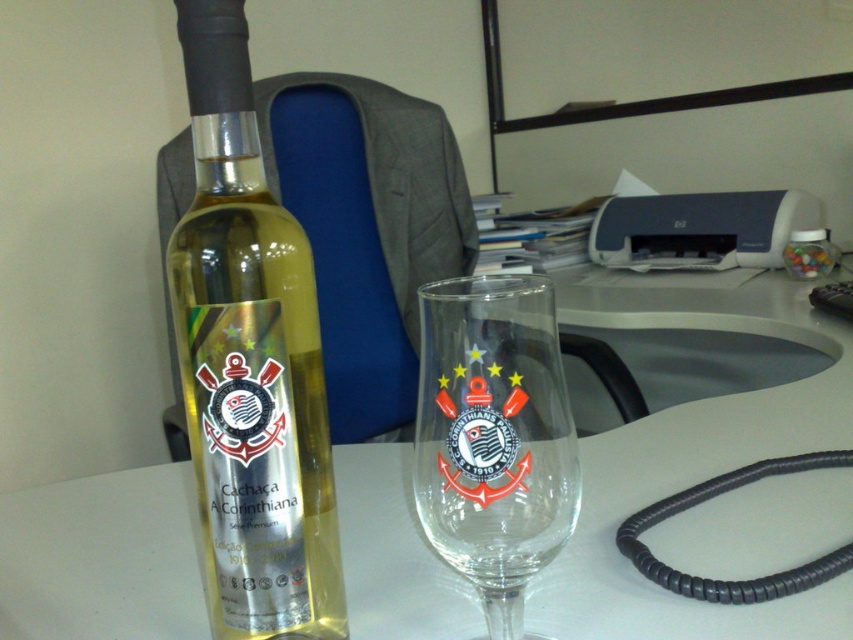
You are organizing a small event and need to know which item is taller between the translucent glass bottle at center and the transparent glass at center. Can you determine this based on the scene?

The translucent glass bottle at center is taller than the transparent glass at center.